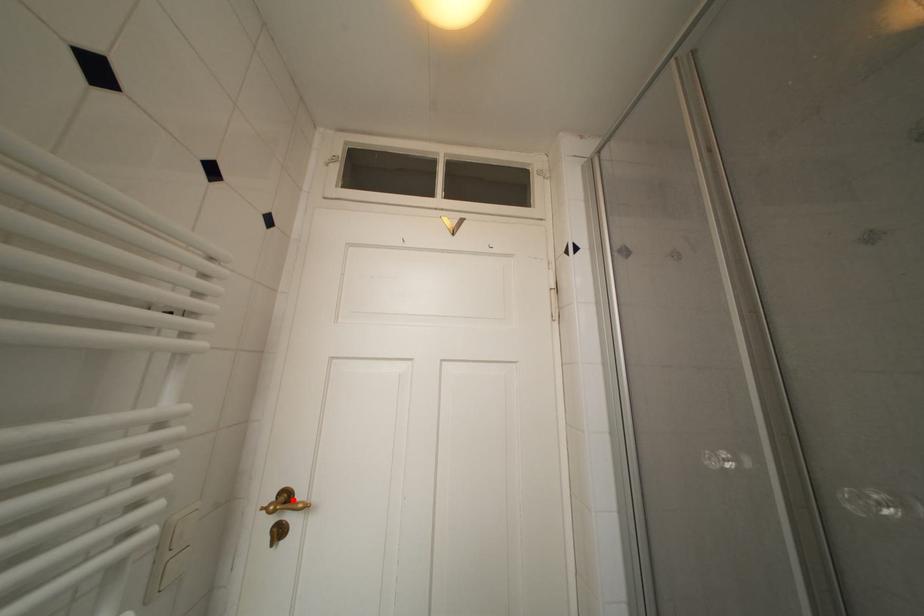
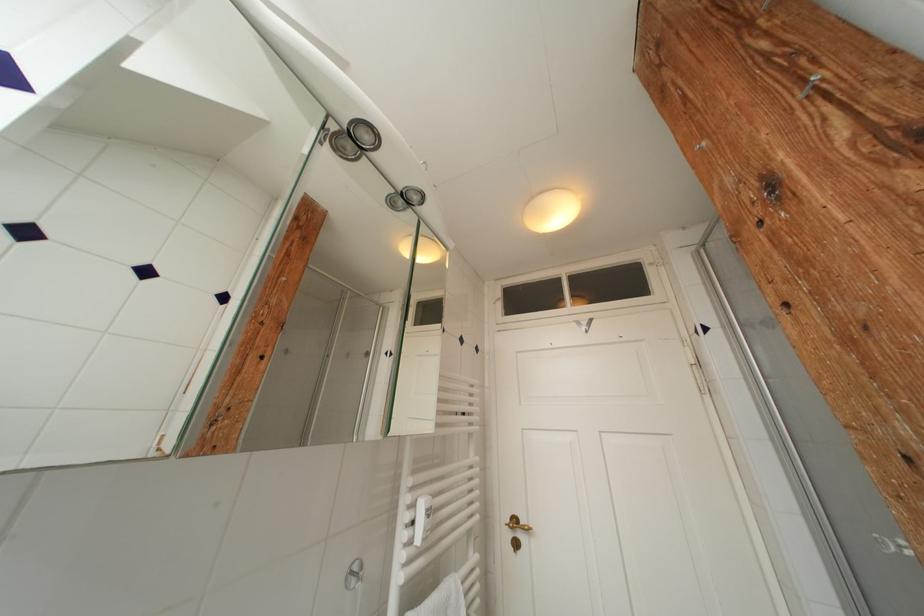
Locate, in the second image, the point that corresponds to the highlighted location in the first image.

(521, 525)